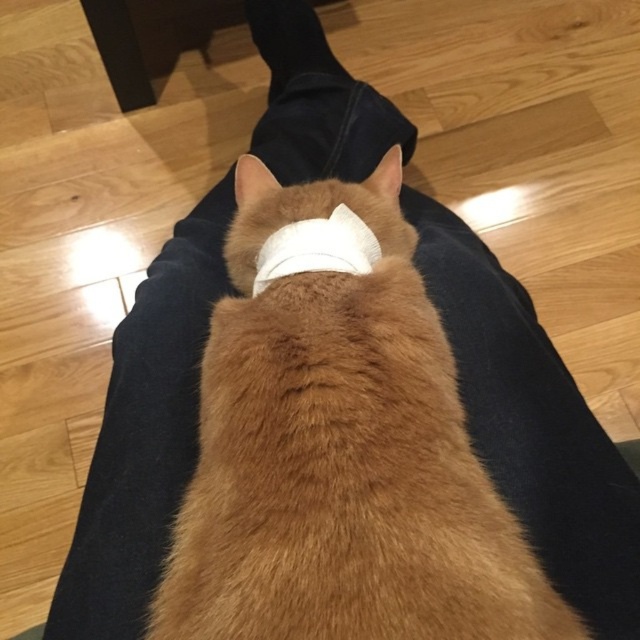
You are taking a photo of the scene and want to focus on the point closer to the camera between point (264,420) and point (376,259). Which point should you choose?

You should choose point (264,420) because it is closer to the camera than point (376,259) according to the description.

You are a photographer trying to capture a closeup of the orange fur cat at center and the white fabric bandage at center. Which object should you zoom in on to ensure it fills the frame without cropping?

The orange fur cat at center is larger in width than the white fabric bandage at center, so you should zoom in on the orange fur cat at center to ensure it fills the frame without cropping.

You are a photographer trying to capture the orange fur cat at center and the white fabric bandage at center in a single shot. Which object should you focus on first to ensure both are in clear view?

The orange fur cat at center is in front of the white fabric bandage at center, so you should focus on the orange fur cat at center first to ensure both are in clear view.